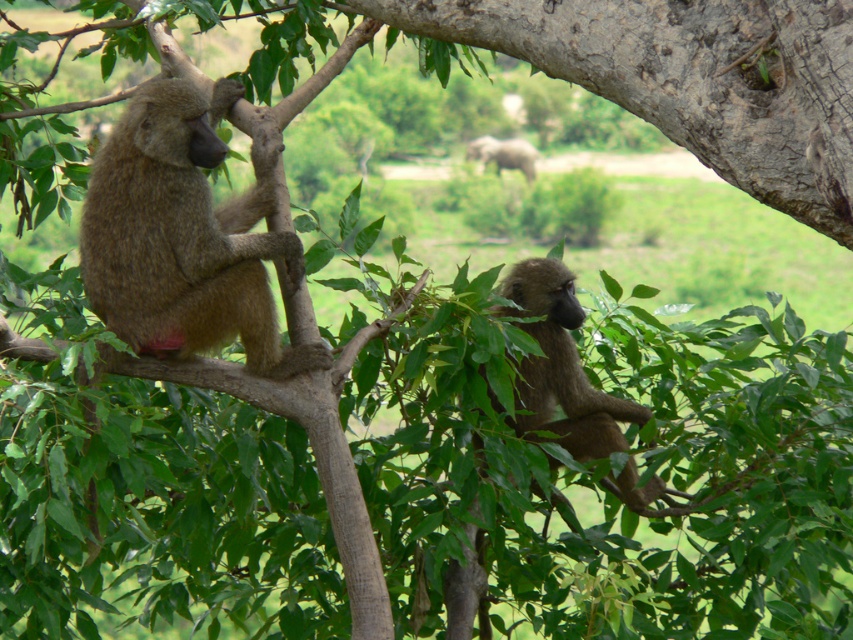
Question: Which point is closer to the camera?

Choices:
 (A) brown furry monkey at left
 (B) brown furry monkey at center

Answer: (A)

Question: Does brown furry monkey at left have a larger size compared to brown furry monkey at center?

Choices:
 (A) no
 (B) yes

Answer: (B)

Question: Can you confirm if brown furry monkey at left is smaller than brown furry monkey at center?

Choices:
 (A) yes
 (B) no

Answer: (B)

Question: Can you confirm if brown furry monkey at left is wider than brown furry monkey at center?

Choices:
 (A) yes
 (B) no

Answer: (A)